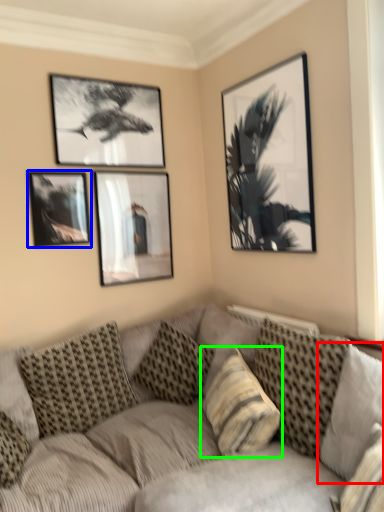
Question: Estimate the real-world distances between objects in this image. Which object is closer to pillow (highlighted by a red box), picture frame (highlighted by a blue box) or pillow (highlighted by a green box)?

Choices:
 (A) picture frame
 (B) pillow

Answer: (B)